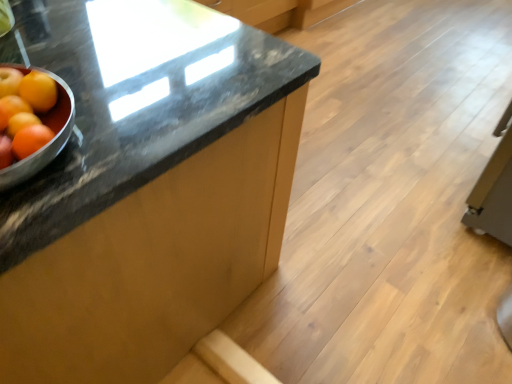
Where is `unoccupied space behind orange matte at left`? The image size is (512, 384). unoccupied space behind orange matte at left is located at coordinates (83, 64).